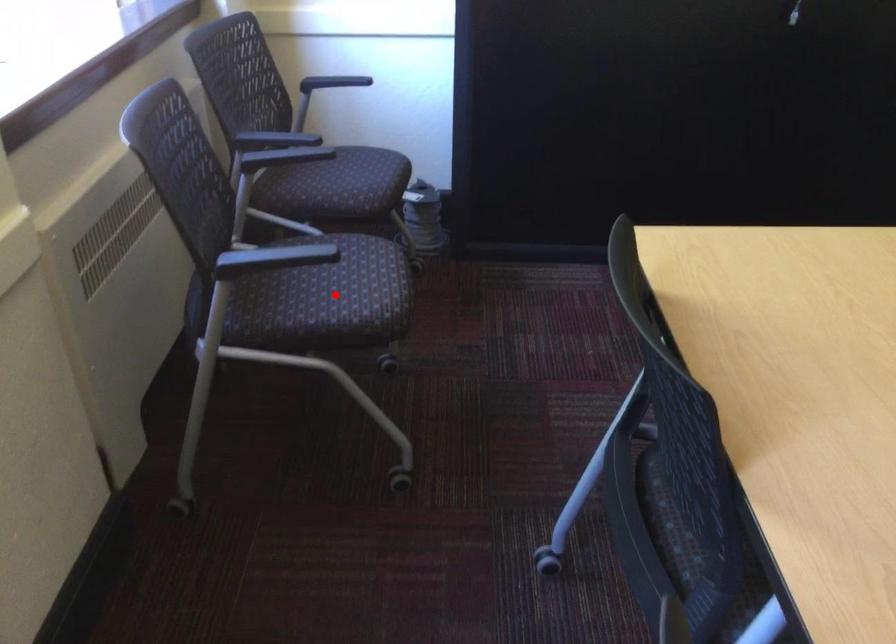
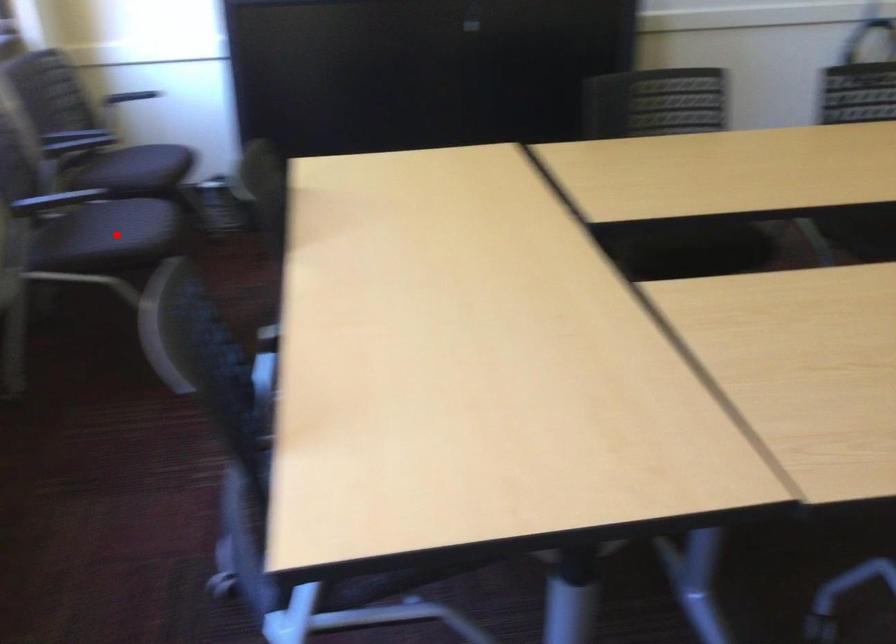
I am providing you with two images of the same scene from different viewpoints. A red point is marked on the first image and another point is marked on the second image. Are the points marked in image1 and image2 representing the same 3D position?

Yes